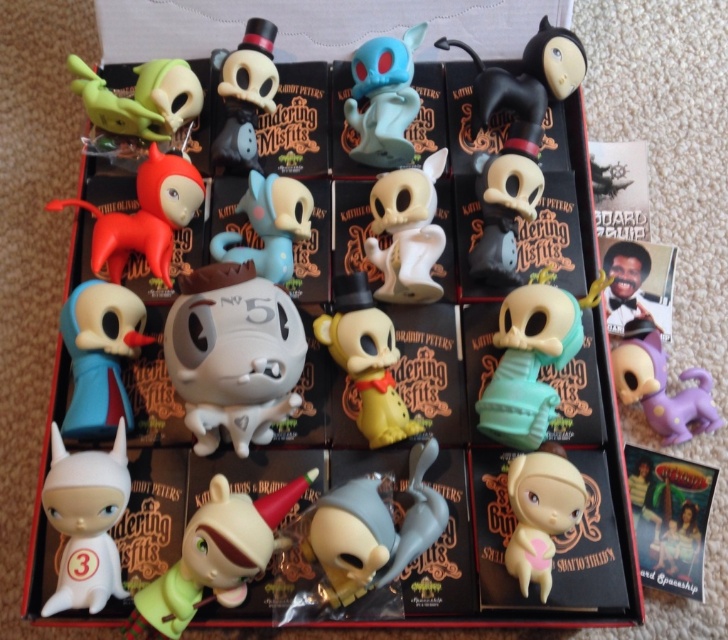
Is matte gray skull at center to the right of yellow matte figurine at center from the viewer's perspective?

Correct, you'll find matte gray skull at center to the right of yellow matte figurine at center.

Which is above, matte gray skull at center or yellow matte figurine at center?

yellow matte figurine at center

Does point (416, 468) lie in front of point (336, 353)?

Yes.

Where is `matte gray skull at center`? This screenshot has width=728, height=640. matte gray skull at center is located at coordinates (373, 529).

What do you see at coordinates (87, 520) in the screenshot?
I see `white matte figurine at lower left` at bounding box center [87, 520].

Between point (47, 506) and point (142, 116), which one is positioned in front?

Point (47, 506)

Locate an element on the screen. This screenshot has width=728, height=640. white matte figurine at lower left is located at coordinates (87, 520).

Describe the element at coordinates (534, 362) in the screenshot. I see `teal matte skeleton at center` at that location.

Who is taller, teal matte skeleton at center or white matte skull at center?

Standing taller between the two is teal matte skeleton at center.

Consider the image. Measure the distance between teal matte skeleton at center and camera.

teal matte skeleton at center is 3.37 feet from camera.

This screenshot has height=640, width=728. What are the coordinates of `teal matte skeleton at center` in the screenshot? It's located at (534, 362).